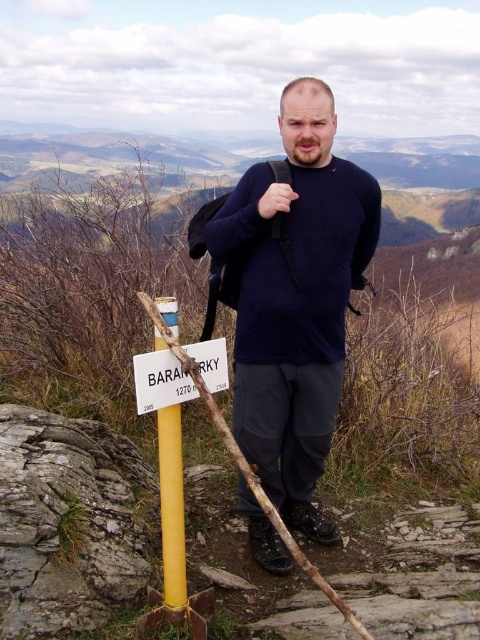
Question: Which of the following is the closest to the observer?

Choices:
 (A) (203, 381)
 (B) (303, 316)

Answer: (A)

Question: Is dark blue sweater at center wider than white plastic sign at lower center?

Choices:
 (A) no
 (B) yes

Answer: (B)

Question: Is yellow metal post at left bigger than yellow plastic post at center?

Choices:
 (A) yes
 (B) no

Answer: (A)

Question: Among these objects, which one is farthest from the camera?

Choices:
 (A) dark blue sweater at center
 (B) yellow metal post at left

Answer: (A)

Question: Which object appears farthest from the camera in this image?

Choices:
 (A) dark blue sweater at center
 (B) yellow plastic post at center
 (C) yellow metal post at left
 (D) white plastic sign at lower center

Answer: (A)

Question: Can you confirm if yellow metal post at left is smaller than yellow plastic post at center?

Choices:
 (A) no
 (B) yes

Answer: (A)